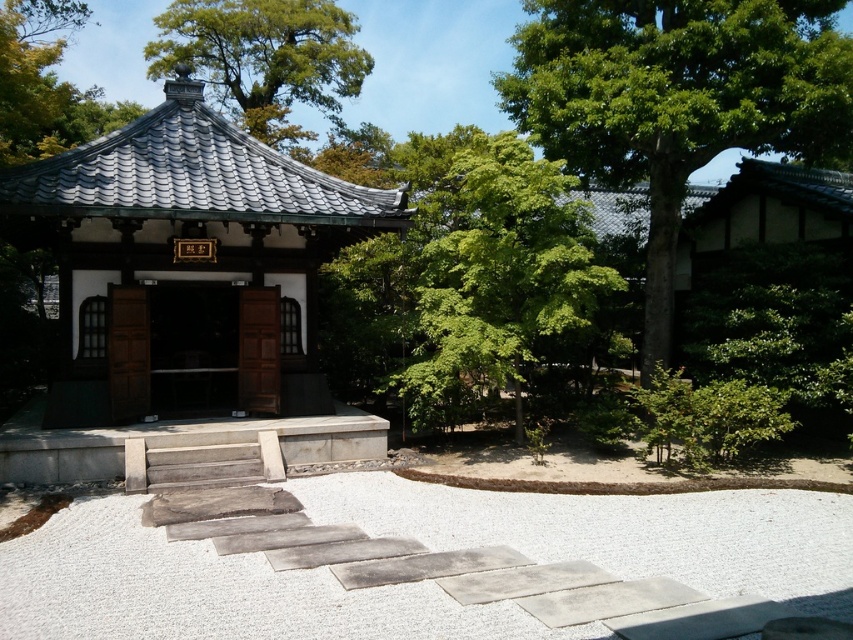
Question: Which object is farther from the camera taking this photo?

Choices:
 (A) matte gray tile gazebo at center
 (B) green leafy tree at upper center
 (C) wooden door at center

Answer: (B)

Question: Observing the image, what is the correct spatial positioning of green leafy tree at center in reference to green leafy tree at upper left?

Choices:
 (A) below
 (B) above

Answer: (A)

Question: Which object appears closest to the camera in this image?

Choices:
 (A) green leafy tree at upper center
 (B) white gravel at center
 (C) green leafy tree at upper left

Answer: (B)

Question: Is green leafy tree at center thinner than green leafy tree at upper left?

Choices:
 (A) no
 (B) yes

Answer: (B)

Question: Observing the image, what is the correct spatial positioning of green leafy tree at upper center in reference to wooden door at center?

Choices:
 (A) above
 (B) below

Answer: (A)

Question: Which point is closer to the camera?

Choices:
 (A) green leafy tree at upper right
 (B) matte gray tile gazebo at center

Answer: (A)